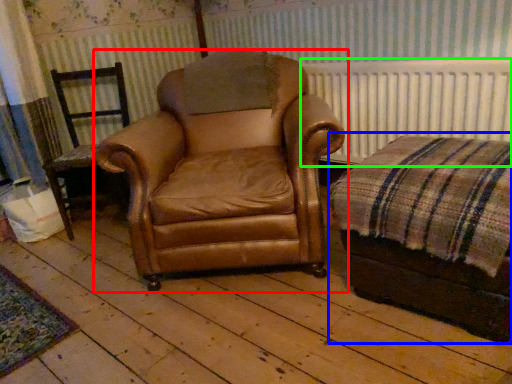
Question: Estimate the real-world distances between objects in this image. Which object is closer to chair (highlighted by a red box), couch (highlighted by a blue box) or radiator (highlighted by a green box)?

Choices:
 (A) couch
 (B) radiator

Answer: (A)